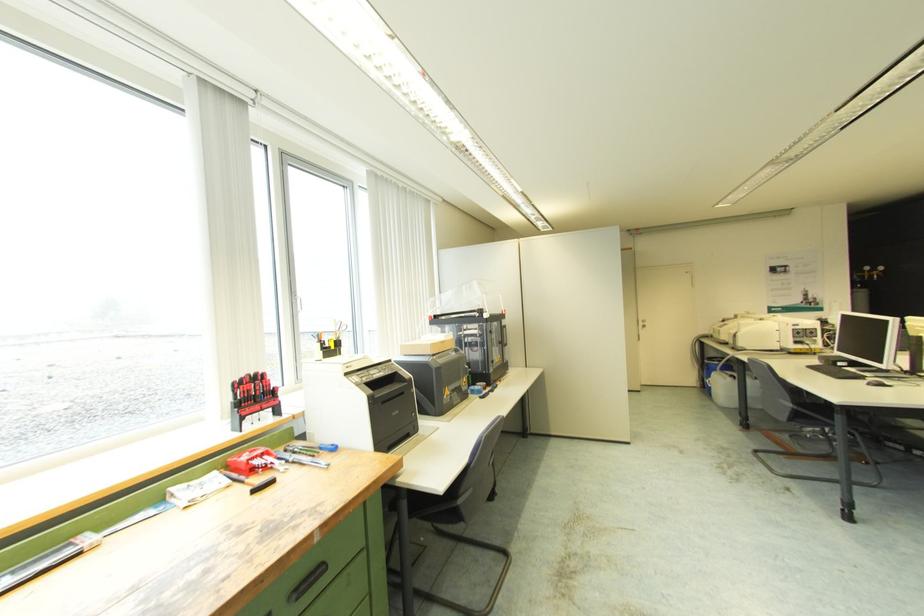
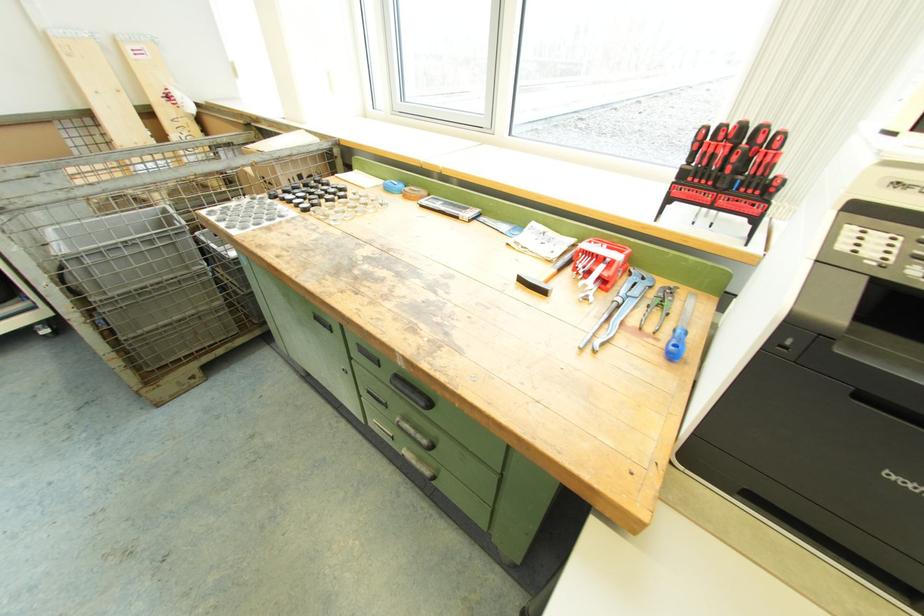
The point at [261,400] is marked in the first image. Where is the corresponding point in the second image?

(723, 185)